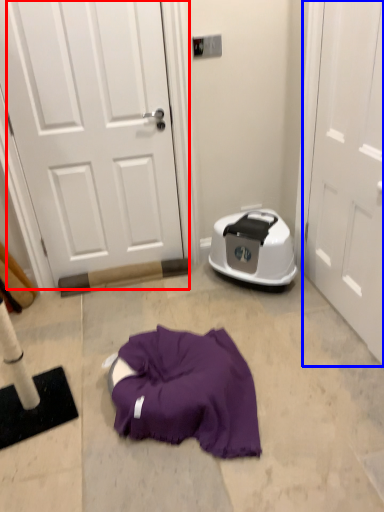
Question: Among these objects, which one is nearest to the camera, door (highlighted by a red box) or door (highlighted by a blue box)?

Choices:
 (A) door
 (B) door

Answer: (B)